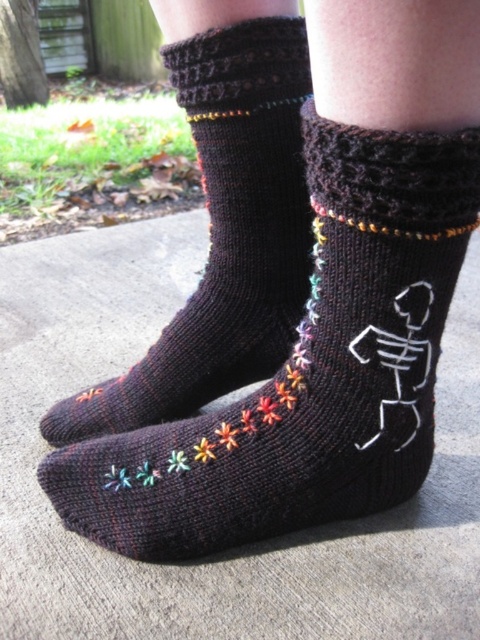
Between black knitted socks at center and black knitted socks at lower left, which one has less height?

With less height is black knitted socks at center.

Who is lower down, black knitted socks at center or black knitted socks at lower left?

black knitted socks at center is below.

This screenshot has width=480, height=640. Describe the element at coordinates (286, 349) in the screenshot. I see `black knitted socks at center` at that location.

Locate an element on the screen. The height and width of the screenshot is (640, 480). black knitted socks at center is located at coordinates (286, 349).